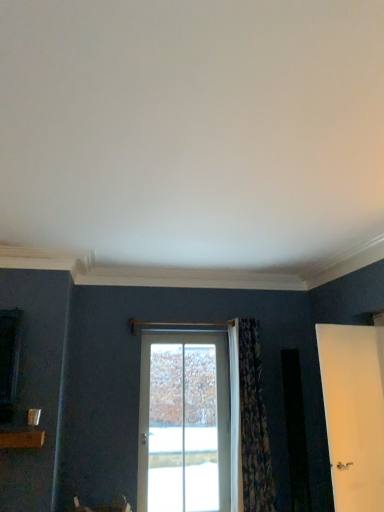
Question: Does white matte door at right, the 1th door from the right, have a larger size compared to white glass door at center, the second door positioned from the right?

Choices:
 (A) yes
 (B) no

Answer: (B)

Question: Can you confirm if white matte door at right, the 1th door from the right, is shorter than white glass door at center, acting as the first door starting from the left?

Choices:
 (A) no
 (B) yes

Answer: (B)

Question: Is white matte door at right, the 1th door from the right, closer to the viewer compared to white glass door at center, the second door positioned from the right?

Choices:
 (A) yes
 (B) no

Answer: (A)

Question: Is white matte door at right, the 1th door from the right, taller than white glass door at center, acting as the first door starting from the left?

Choices:
 (A) yes
 (B) no

Answer: (B)

Question: Does white matte door at right, which is the second door from left to right, appear on the right side of white glass door at center, acting as the first door starting from the left?

Choices:
 (A) no
 (B) yes

Answer: (B)

Question: Is white matte door at right, which is the second door from left to right, thinner than white glass door at center, placed as the second door when sorted from front to back?

Choices:
 (A) no
 (B) yes

Answer: (B)

Question: Is white glass door at center, which is the first door in back-to-front order, wider than white matte door at right, arranged as the 2th door when viewed from the back?

Choices:
 (A) no
 (B) yes

Answer: (B)

Question: Can we say white glass door at center, which is the first door in back-to-front order, lies outside white matte door at right, which is the second door from left to right?

Choices:
 (A) no
 (B) yes

Answer: (B)

Question: Is white glass door at center, the second door positioned from the right, in contact with white matte door at right, arranged as the 2th door when viewed from the back?

Choices:
 (A) yes
 (B) no

Answer: (B)

Question: Is white glass door at center, which is the first door in back-to-front order, to the left of white matte door at right, which is the second door from left to right, from the viewer's perspective?

Choices:
 (A) no
 (B) yes

Answer: (B)

Question: From a real-world perspective, is white glass door at center, acting as the first door starting from the left, over white matte door at right, the 1th door from the right?

Choices:
 (A) yes
 (B) no

Answer: (B)

Question: Can you confirm if white glass door at center, placed as the second door when sorted from front to back, is shorter than white matte door at right, the 1th door from the right?

Choices:
 (A) no
 (B) yes

Answer: (A)

Question: Is white matte door at right, the 1th door from the right, oriented towards patterned fabric curtain at center?

Choices:
 (A) no
 (B) yes

Answer: (A)